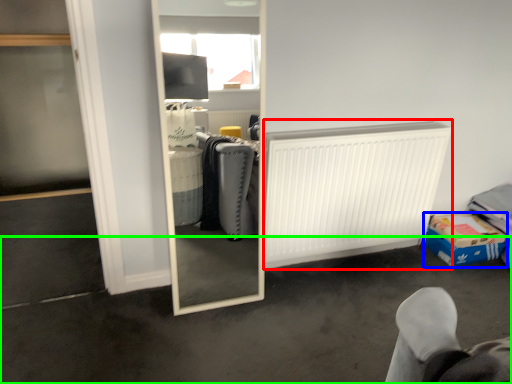
Question: Which object is the farthest from radiator (highlighted by a red box)? Choose among these: cardboard box (highlighted by a blue box) or concrete (highlighted by a green box).

Choices:
 (A) cardboard box
 (B) concrete

Answer: (A)